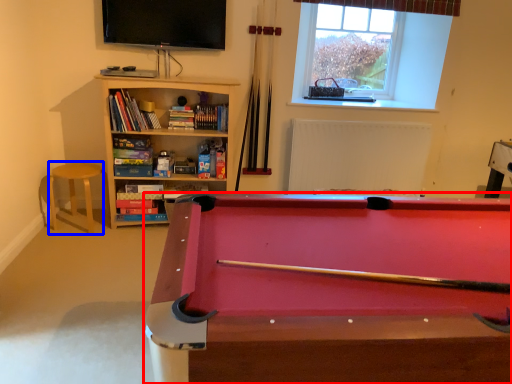
Question: Among these objects, which one is nearest to the camera, billiard table (highlighted by a red box) or bar stool (highlighted by a blue box)?

Choices:
 (A) billiard table
 (B) bar stool

Answer: (A)